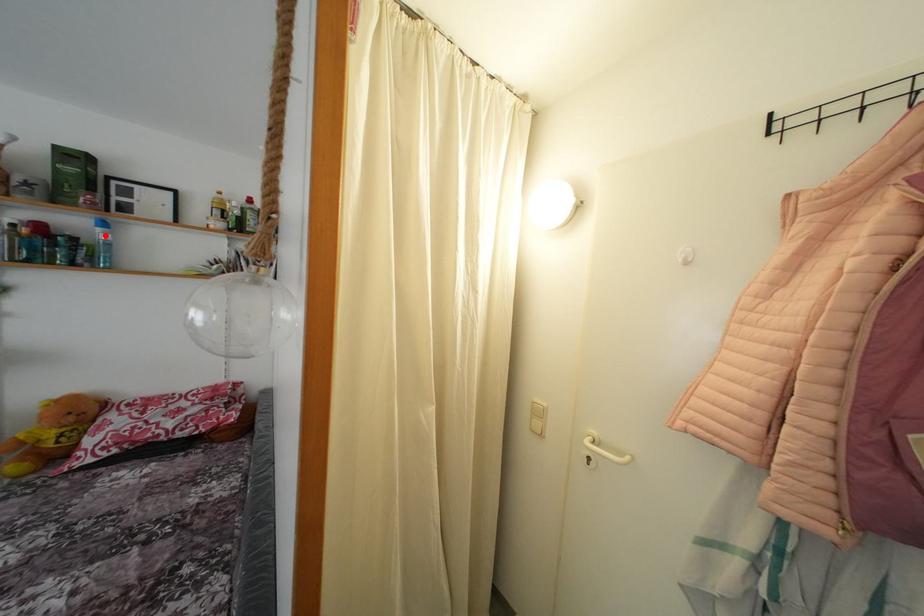
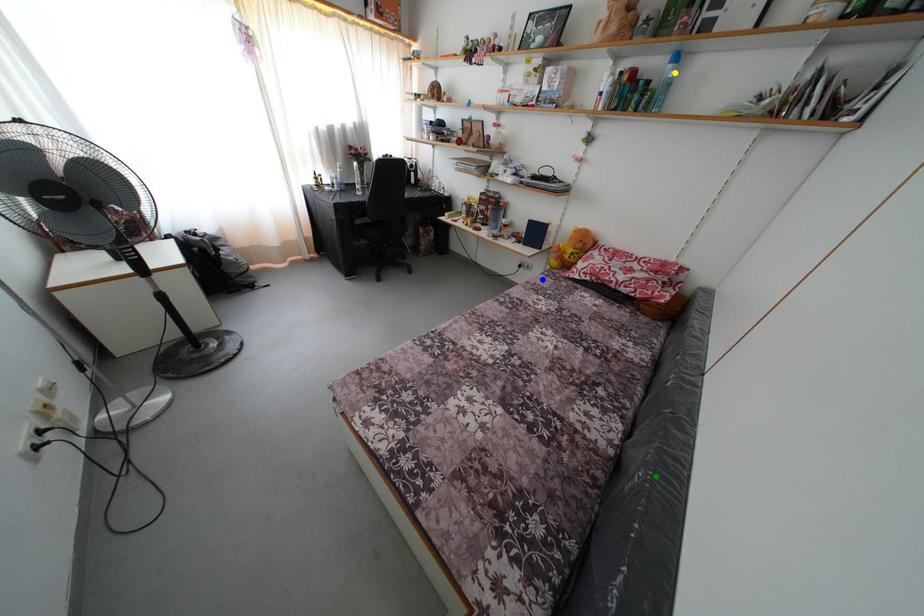
Question: I am providing you with two images of the same scene from different viewpoints. A red point is marked on the first image. You are given multiple points on the second image. Can you choose the point in image 2 that corresponds to the point in image 1?

Choices:
 (A) green point
 (B) blue point
 (C) yellow point

Answer: (C)